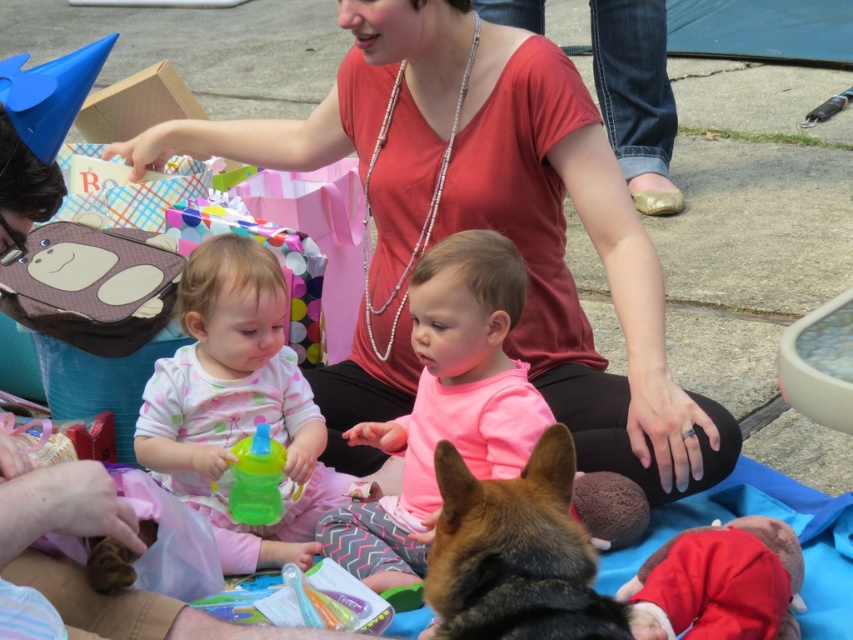
You are organizing a birthday party and need to arrange the pink fabric dress at center and the translucent plastic sippy cup at center on a shelf. If the shelf has limited space, which item should you place first to ensure both fit?

The pink fabric dress at center is wider than the translucent plastic sippy cup at center. To ensure both fit on the shelf with limited space, place the wider pink fabric dress at center first, then the narrower translucent plastic sippy cup at center next.

You are a photographer at the birthday party. You want to take a photo that includes both the brown fur dog at lower center and the translucent plastic sippy cup at center. What is the minimum distance you need to maintain between these two objects to ensure they are both in focus?

The minimum distance you need to maintain between the brown fur dog at lower center and the translucent plastic sippy cup at center is 37.55 inches to ensure both are in focus.

You are standing at the center of the image and want to hand out a gift to the person closest to you. Which point, point (479, 614) or point (236, 467), is closer to your current position?

Point (479, 614) is in front of point (236, 467), so it is closer to your current position at the center of the image.